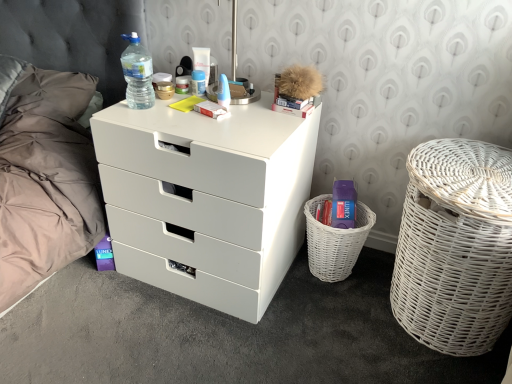
Find the location of a particular element. This screenshot has width=512, height=384. blue plastic toothbrush at upper center, the fourth toiletry when ordered from left to right is located at coordinates (223, 92).

The height and width of the screenshot is (384, 512). What do you see at coordinates (198, 83) in the screenshot?
I see `blue plastic container at center, arranged as the 2th toiletry when viewed from the left` at bounding box center [198, 83].

This screenshot has height=384, width=512. What do you see at coordinates (137, 74) in the screenshot?
I see `translucent plastic bottle at upper left` at bounding box center [137, 74].

The height and width of the screenshot is (384, 512). What do you see at coordinates (57, 128) in the screenshot? I see `dark gray fabric bed at left` at bounding box center [57, 128].

Image resolution: width=512 pixels, height=384 pixels. I want to click on white wicker basket at lower right, so click(335, 241).

From a real-world perspective, which object rests below the other?

From a 3D spatial view, blue plastic toothbrush at upper center, the fourth toiletry when ordered from left to right, is below.

Which object is wider, blue plastic toothbrush at upper center, the fourth toiletry when ordered from left to right, or translucent plastic bottle at upper left?

translucent plastic bottle at upper left is wider.

Is blue plastic toothbrush at upper center, the fourth toiletry when ordered from left to right, taller than translucent plastic bottle at upper left?

Incorrect, the height of blue plastic toothbrush at upper center, the fourth toiletry when ordered from left to right, is not larger of that of translucent plastic bottle at upper left.

From the image's perspective, between blue plastic toothbrush at upper center, the fourth toiletry when ordered from left to right, and translucent plastic bottle at upper left, which one is located above?

translucent plastic bottle at upper left.

Is white wicker basket at lower right bigger than matte plastic container at center, which is counted as the 1th toiletry, starting from the left?

Correct, white wicker basket at lower right is larger in size than matte plastic container at center, which is counted as the 1th toiletry, starting from the left.

Could you tell me if white wicker basket at lower right is facing matte plastic container at center, which appears as the 4th toiletry when viewed from the right?

No.

Which object is positioned more to the left, white wicker basket at lower right or matte plastic container at center, which is counted as the 1th toiletry, starting from the left?

matte plastic container at center, which is counted as the 1th toiletry, starting from the left.

Relative to matte plastic container at center, which appears as the 4th toiletry when viewed from the right, is white wicker basket at lower right in front or behind?

In the image, white wicker basket at lower right appears in front of matte plastic container at center, which appears as the 4th toiletry when viewed from the right.

Is translucent plastic bottle at upper left surrounded by white wicker basket at right?

No, translucent plastic bottle at upper left is not a part of white wicker basket at right.

Is there a large distance between white wicker basket at right and translucent plastic bottle at upper left?

white wicker basket at right is far away from translucent plastic bottle at upper left.

From the image's perspective, is white wicker basket at right under translucent plastic bottle at upper left?

Yes, from the image's perspective, white wicker basket at right is below translucent plastic bottle at upper left.

The image size is (512, 384). I want to click on basket container below the translucent plastic bottle at upper left (from a real-world perspective), so click(x=455, y=247).

Does point (356, 231) appear closer or farther from the camera than point (209, 63)?

Point (356, 231) is closer to the camera than point (209, 63).

From the picture: Considering the relative sizes of white wicker basket at lower right and white plastic tube at upper center, the 3th toiletry positioned from the left, in the image provided, is white wicker basket at lower right smaller than white plastic tube at upper center, the 3th toiletry positioned from the left,?

Actually, white wicker basket at lower right might be larger than white plastic tube at upper center, the 3th toiletry positioned from the left.

From a real-world perspective, which object rests below the other?

white wicker basket at lower right.

Considering the sizes of objects white wicker basket at lower right and white plastic tube at upper center, the 3th toiletry positioned from the left, in the image provided, who is taller, white wicker basket at lower right or white plastic tube at upper center, the 3th toiletry positioned from the left,?

Standing taller between the two is white wicker basket at lower right.

This screenshot has height=384, width=512. I want to click on basket container below the blue plastic container at center, which appears as the 3th toiletry when viewed from the right (from a real-world perspective), so click(x=455, y=247).

Does blue plastic container at center, arranged as the 2th toiletry when viewed from the left, lie behind white wicker basket at right?

Yes, the depth of blue plastic container at center, arranged as the 2th toiletry when viewed from the left, is greater than that of white wicker basket at right.

Which of these two, blue plastic container at center, which appears as the 3th toiletry when viewed from the right, or white wicker basket at right, stands taller?

Standing taller between the two is white wicker basket at right.

In the scene shown: Is blue plastic toothbrush at upper center, the 1th toiletry when ordered from right to left, positioned with its back to white plastic tube at upper center, the second toiletry from the right?

blue plastic toothbrush at upper center, the 1th toiletry when ordered from right to left, does not have its back to white plastic tube at upper center, the second toiletry from the right.

Looking at this image, is blue plastic toothbrush at upper center, the fourth toiletry when ordered from left to right, not near white plastic tube at upper center, the second toiletry from the right?

That's not correct — blue plastic toothbrush at upper center, the fourth toiletry when ordered from left to right, is a little close to white plastic tube at upper center, the second toiletry from the right.

Considering the positions of objects blue plastic toothbrush at upper center, the 1th toiletry when ordered from right to left, and white plastic tube at upper center, the 3th toiletry positioned from the left, in the image provided, who is in front, blue plastic toothbrush at upper center, the 1th toiletry when ordered from right to left, or white plastic tube at upper center, the 3th toiletry positioned from the left,?

blue plastic toothbrush at upper center, the 1th toiletry when ordered from right to left, is more forward.

From the image's perspective, which is above, blue plastic toothbrush at upper center, the fourth toiletry when ordered from left to right, or white plastic tube at upper center, the 3th toiletry positioned from the left?

white plastic tube at upper center, the 3th toiletry positioned from the left, is shown above in the image.

Based on the photo, considering the sizes of objects white plastic tube at upper center, the second toiletry from the right, and blue plastic container at center, arranged as the 2th toiletry when viewed from the left, in the image provided, who is wider, white plastic tube at upper center, the second toiletry from the right, or blue plastic container at center, arranged as the 2th toiletry when viewed from the left,?

white plastic tube at upper center, the second toiletry from the right, is wider.

Can you confirm if white plastic tube at upper center, the second toiletry from the right, is taller than blue plastic container at center, arranged as the 2th toiletry when viewed from the left?

Yes.

Is white plastic tube at upper center, the 3th toiletry positioned from the left, not close to blue plastic container at center, which appears as the 3th toiletry when viewed from the right?

white plastic tube at upper center, the 3th toiletry positioned from the left, is actually quite close to blue plastic container at center, which appears as the 3th toiletry when viewed from the right.

Which point is more forward, (199, 48) or (204, 90)?

The point (204, 90) is closer.

The width and height of the screenshot is (512, 384). Find the location of `bottle in front of the blue plastic toothbrush at upper center, the fourth toiletry when ordered from left to right`. bottle in front of the blue plastic toothbrush at upper center, the fourth toiletry when ordered from left to right is located at coordinates (137, 74).

Which toiletry is the 3rd one when counting from the back of the white wicker basket at lower right? Please provide its 2D coordinates.

[(182, 85)]

Estimate the real-world distances between objects in this image. Which object is closer to white wicker basket at right, white wicker basket at lower right or dark gray fabric bed at left?

white wicker basket at lower right is positioned closer to the anchor white wicker basket at right.

From the image, which object appears to be farther from white matte chest of drawers at center, white plastic tube at upper center, the second toiletry from the right, or blue plastic container at center, which appears as the 3th toiletry when viewed from the right?

Based on the image, white plastic tube at upper center, the second toiletry from the right, appears to be further to white matte chest of drawers at center.

From the image, which object appears to be nearer to dark gray fabric bed at left, translucent plastic bottle at upper left or white wicker basket at lower right?

Among the two, translucent plastic bottle at upper left is located nearer to dark gray fabric bed at left.

Which object lies further to the anchor point matte plastic container at center, which is counted as the 1th toiletry, starting from the left, white wicker basket at right or white plastic tube at upper center, the 3th toiletry positioned from the left?

The object further to matte plastic container at center, which is counted as the 1th toiletry, starting from the left, is white wicker basket at right.

Considering their positions, is white wicker basket at lower right positioned closer to blue plastic toothbrush at upper center, the fourth toiletry when ordered from left to right, than translucent plastic bottle at upper left?

The object closer to blue plastic toothbrush at upper center, the fourth toiletry when ordered from left to right, is translucent plastic bottle at upper left.

Looking at the image, which one is located closer to white plastic tube at upper center, the 3th toiletry positioned from the left, translucent plastic bottle at upper left or matte plastic container at center, which appears as the 4th toiletry when viewed from the right?

matte plastic container at center, which appears as the 4th toiletry when viewed from the right, is positioned closer to the anchor white plastic tube at upper center, the 3th toiletry positioned from the left.

Estimate the real-world distances between objects in this image. Which object is closer to blue plastic container at center, which appears as the 3th toiletry when viewed from the right, matte plastic container at center, which appears as the 4th toiletry when viewed from the right, or dark gray fabric bed at left?

matte plastic container at center, which appears as the 4th toiletry when viewed from the right.

From the picture: From the image, which object appears to be farther from white matte chest of drawers at center, white wicker basket at lower right or translucent plastic bottle at upper left?

Among the two, white wicker basket at lower right is located further to white matte chest of drawers at center.

At what (x,y) coordinates should I click in order to perform the action: click on chest of drawers between blue plastic container at center, which appears as the 3th toiletry when viewed from the right, and white wicker basket at right from left to right. Please return your answer as a coordinate pair (x, y). Looking at the image, I should click on (207, 199).

The height and width of the screenshot is (384, 512). I want to click on basket between white matte chest of drawers at center and white wicker basket at right in the horizontal direction, so click(x=335, y=241).

I want to click on chest of drawers between white plastic tube at upper center, the 3th toiletry positioned from the left, and white wicker basket at lower right from top to bottom, so click(x=207, y=199).

You are a GUI agent. You are given a task and a screenshot of the screen. Output one action in this format:
    pyautogui.click(x=<x>, y=<y>)
    Task: Click on the bottle between dark gray fabric bed at left and white plastic tube at upper center, the second toiletry from the right, in the horizontal direction
    The width and height of the screenshot is (512, 384).
    Given the screenshot: What is the action you would take?
    pyautogui.click(x=137, y=74)